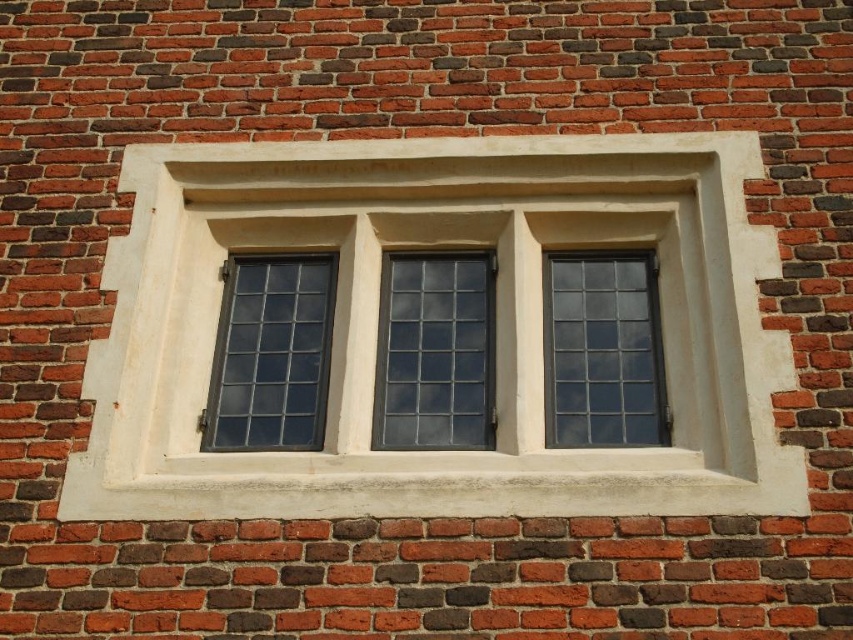
Question: Observing the image, what is the correct spatial positioning of matte glass window at center in reference to dark glass window at left?

Choices:
 (A) left
 (B) right

Answer: (B)

Question: Is matte glass window at center positioned before dark glass window at left?

Choices:
 (A) no
 (B) yes

Answer: (A)

Question: Which of the following is the closest to the observer?

Choices:
 (A) (257, 353)
 (B) (509, 364)

Answer: (B)

Question: Which of the following is the farthest from the observer?

Choices:
 (A) (563, 388)
 (B) (567, 172)
 (C) (387, 444)
 (D) (225, 424)

Answer: (B)

Question: Which point appears closest to the camera in this image?

Choices:
 (A) (672, 396)
 (B) (221, 340)

Answer: (A)

Question: Is white stone window frame at center below matte glass window at center?

Choices:
 (A) yes
 (B) no

Answer: (B)